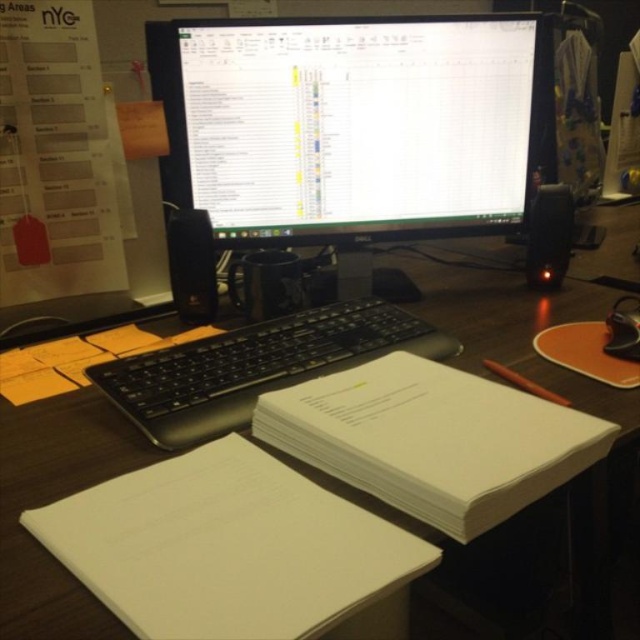
Question: Which object is the farthest from the white glossy monitor at center?

Choices:
 (A) white paper notebook at center
 (B) black plastic keyboard at center
 (C) white paper notebook at lower center
 (D) wooden desk at center

Answer: (C)

Question: Among these points, which one is farthest from the camera?

Choices:
 (A) (333, 333)
 (B) (28, 580)
 (C) (317, 60)

Answer: (C)

Question: Is white glossy monitor at center positioned in front of black plastic keyboard at center?

Choices:
 (A) yes
 (B) no

Answer: (B)

Question: Is white glossy monitor at center positioned in front of white paper notebook at center?

Choices:
 (A) yes
 (B) no

Answer: (B)

Question: Is white glossy monitor at center smaller than white paper notebook at center?

Choices:
 (A) no
 (B) yes

Answer: (A)

Question: Which object is closer to the camera taking this photo?

Choices:
 (A) white glossy monitor at center
 (B) wooden desk at center
 (C) white paper notebook at center
 (D) black plastic keyboard at center

Answer: (C)